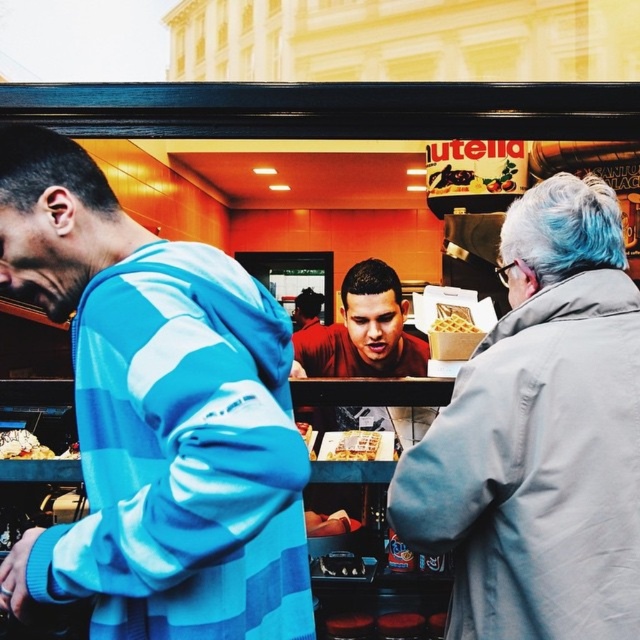
You are standing in the bakery and want to take a photo of both the Nutella advertisement and the display case. The Nutella advertisement is at point [609,413] and the display case is at point [435,179]. Since you can only focus on one point at a time, which point should you focus on to capture both in the frame?

You should focus on point [609,413] because it is closer to the camera than point [435,179], allowing both points to be in the same frame.

You are standing at the counter in the bakery and see two points marked on the floor. The first point is at coordinate point (310, 332) and the second is at point (440, 324). If you want to move from the first point to the second point, which direction should you walk relative to the counter?

Since point (310, 332) is behind point (440, 324), you should walk forward towards the counter to move from the first point to the second point.